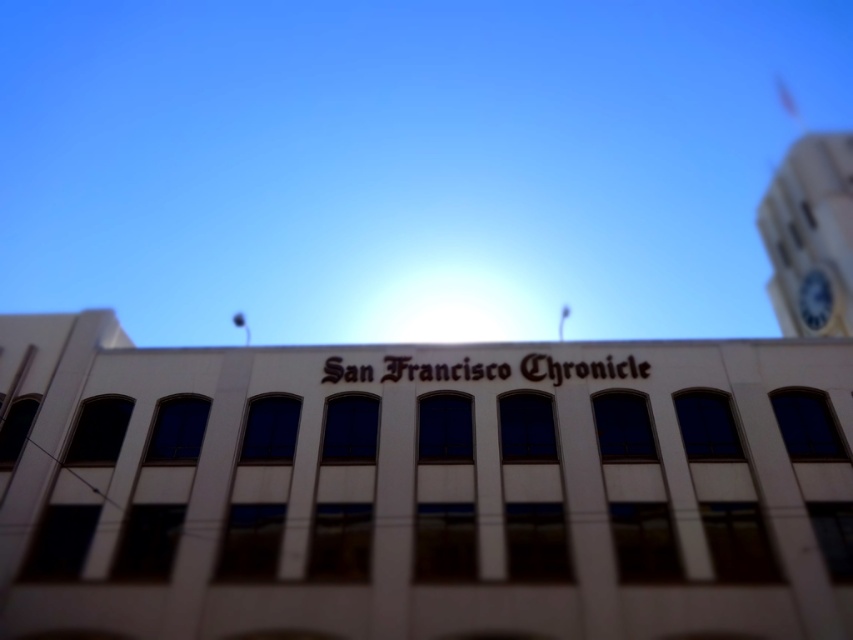
Question: Which point is farther to the camera?

Choices:
 (A) blue metallic clock at upper right
 (B) white clock tower at upper right

Answer: (A)

Question: Does white clock tower at upper right have a lesser width compared to blue metallic clock at upper right?

Choices:
 (A) no
 (B) yes

Answer: (A)

Question: Is white clock tower at upper right closer to camera compared to blue metallic clock at upper right?

Choices:
 (A) yes
 (B) no

Answer: (A)

Question: Which of the following is the farthest from the observer?

Choices:
 (A) (815, 300)
 (B) (814, 202)

Answer: (B)

Question: Does white clock tower at upper right have a larger size compared to blue metallic clock at upper right?

Choices:
 (A) no
 (B) yes

Answer: (B)